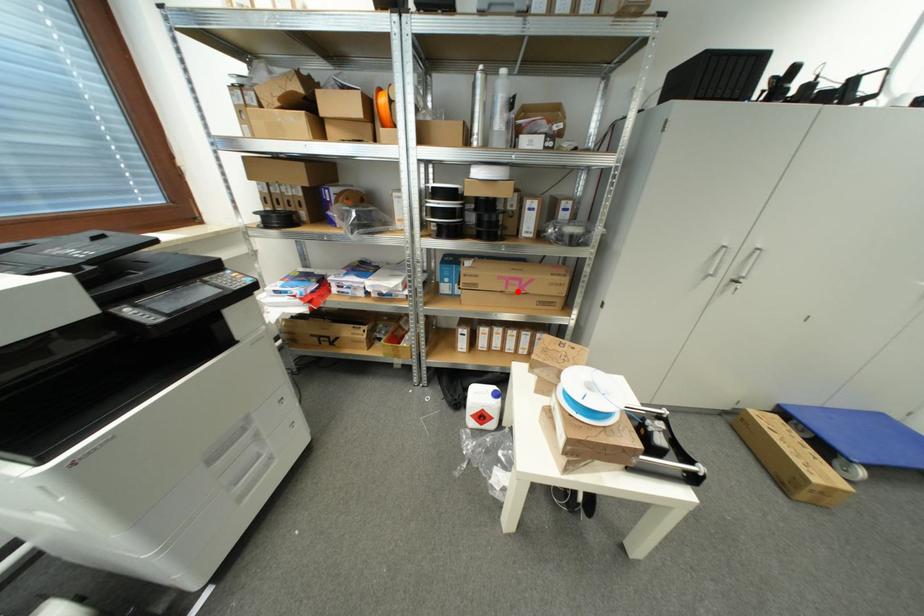
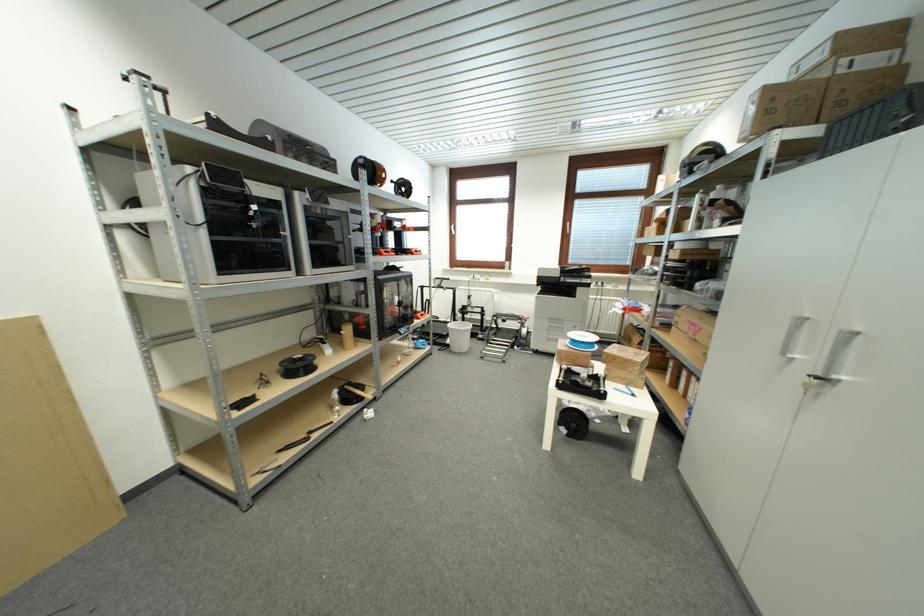
Question: I am providing you with two images of the same scene from different viewpoints. A red point is marked on the first image. Is the red point's position out of view in image 2?

Choices:
 (A) Yes
 (B) No

Answer: (B)